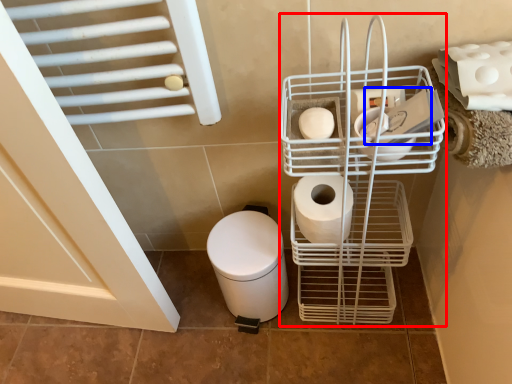
Question: Among these objects, which one is nearest to the camera, shopping cart (highlighted by a red box) or toilet paper (highlighted by a blue box)?

Choices:
 (A) shopping cart
 (B) toilet paper

Answer: (A)